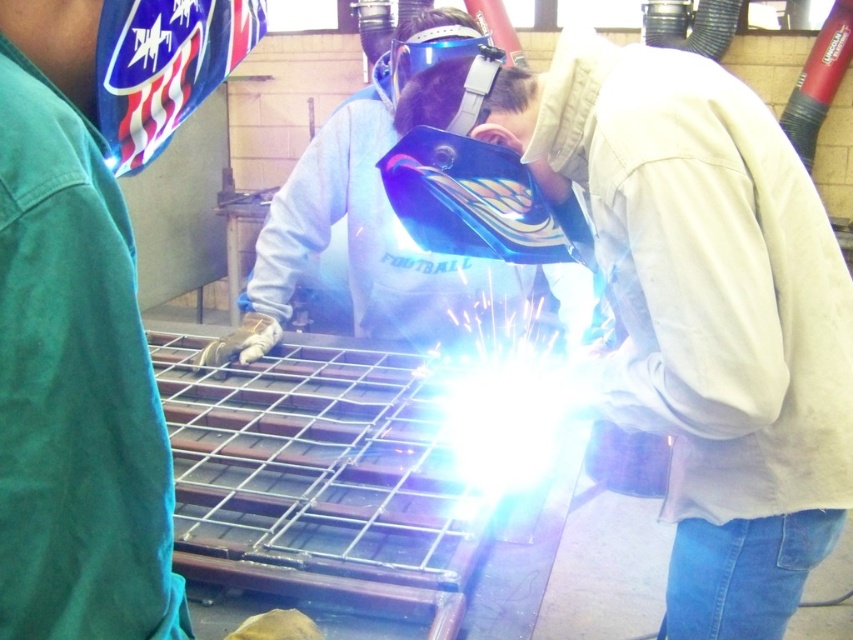
Question: Can you confirm if blue reflective welding helmet at center is positioned below transparent plastic welding mask at center?

Choices:
 (A) yes
 (B) no

Answer: (A)

Question: Which object appears farthest from the camera in this image?

Choices:
 (A) transparent plastic welding mask at center
 (B) matte white welding helmet at upper center

Answer: (A)

Question: Can you confirm if matte white welding helmet at upper center is positioned below transparent plastic welding mask at center?

Choices:
 (A) yes
 (B) no

Answer: (A)

Question: Which point is closer to the camera taking this photo?

Choices:
 (A) pyautogui.click(x=405, y=285)
 (B) pyautogui.click(x=486, y=33)

Answer: (A)

Question: Does matte blue welding helmet at center have a larger size compared to blue reflective welding helmet at center?

Choices:
 (A) no
 (B) yes

Answer: (A)

Question: Based on their relative distances, which object is farther from the matte blue welding helmet at center?

Choices:
 (A) matte white welding helmet at upper center
 (B) blue reflective welding helmet at center
 (C) transparent plastic welding mask at center

Answer: (B)